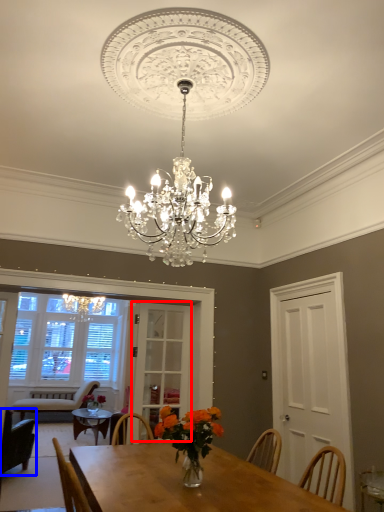
Question: Which object appears farthest to the camera in this image, glass door (highlighted by a red box) or chair (highlighted by a blue box)?

Choices:
 (A) glass door
 (B) chair

Answer: (B)